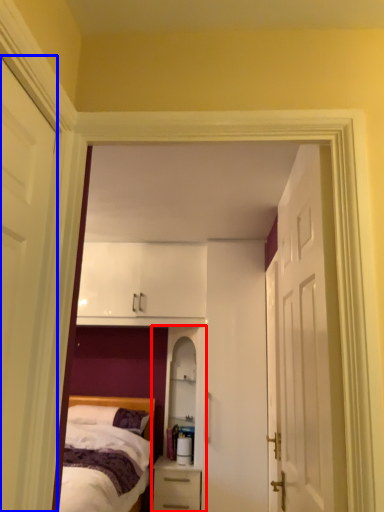
Question: Which point is further to the camera, dresser (highlighted by a red box) or door (highlighted by a blue box)?

Choices:
 (A) dresser
 (B) door

Answer: (A)